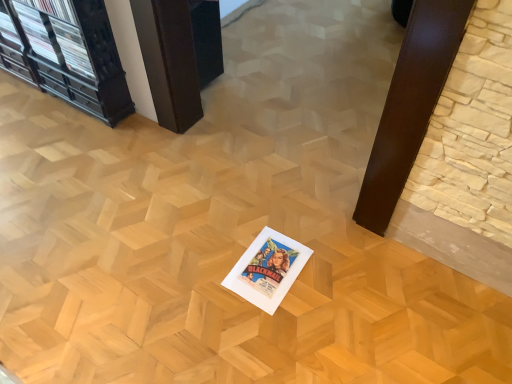
Identify the location of empty space that is ontop of white paper at center (from a real-world perspective). (267, 267).